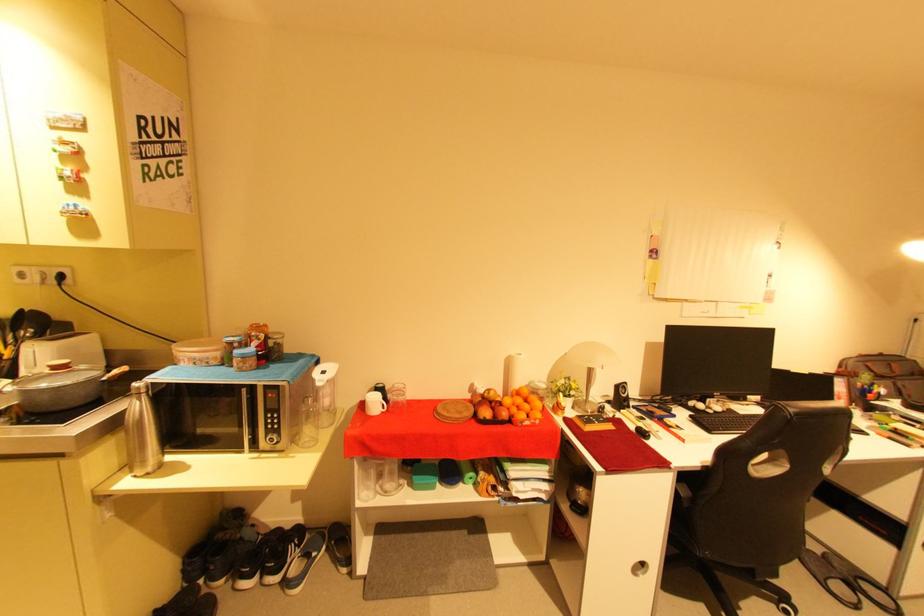
Locate an element on the screen. orange fruit is located at coordinates (506, 407).